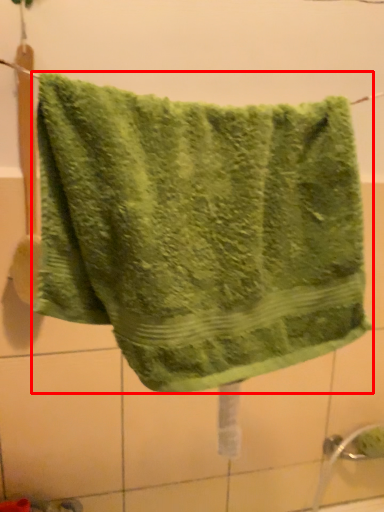
Question: Considering the relative positions of towel (annotated by the red box) and tile in the image provided, where is towel (annotated by the red box) located with respect to the staircase?

Choices:
 (A) right
 (B) left

Answer: (A)